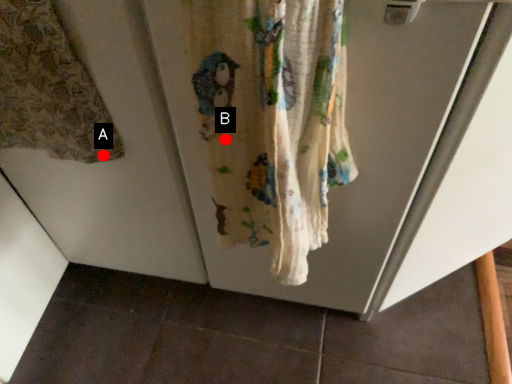
Question: Two points are circled on the image, labeled by A and B beside each circle. Which point appears closest to the camera in this image?

Choices:
 (A) A is closer
 (B) B is closer

Answer: (B)